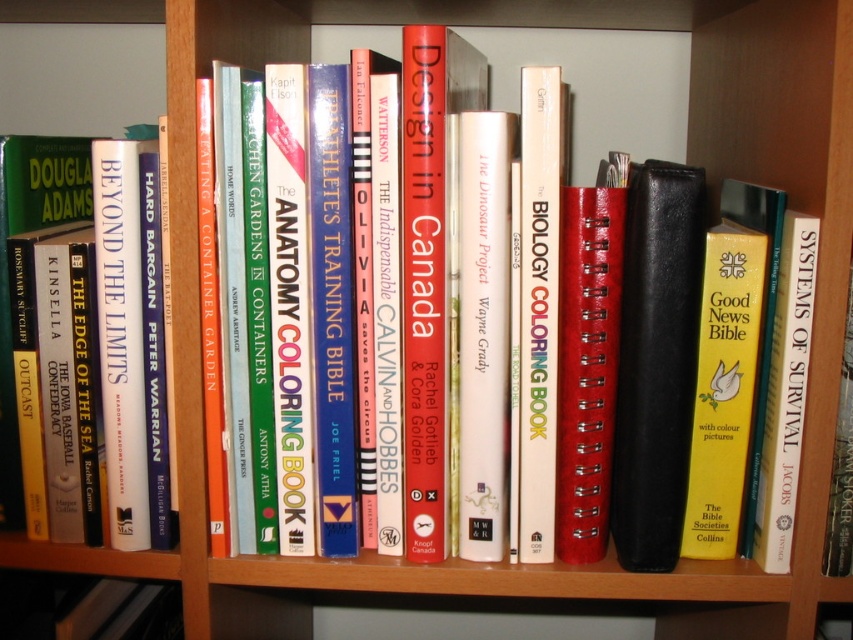
You are organizing books on a shelf and notice the hardback book at left and the hardcover biology coloring book at center. Which book is positioned farther away from the front of the shelf?

The hardcover biology coloring book at center is behind the hardback book at left, so it is positioned farther away from the front of the shelf.

You are organizing books on a shelf and need to place a new book between the hardback book at left and the hardcover biology coloring book at center. Is there enough space between them to fit a standard 2cm thick book?

The hardback book at left is to the left of the hardcover biology coloring book at center, so there is space between them. A standard 2cm thick book can fit in the space between them.

You are standing in front of the wooden bookshelf and notice two points marked on the image at coordinates point (55, 161) and point (556, 93). Which point is closer to you?

Point (55, 161) is further to the camera than point (556, 93), so the point closer to you is point (556, 93).